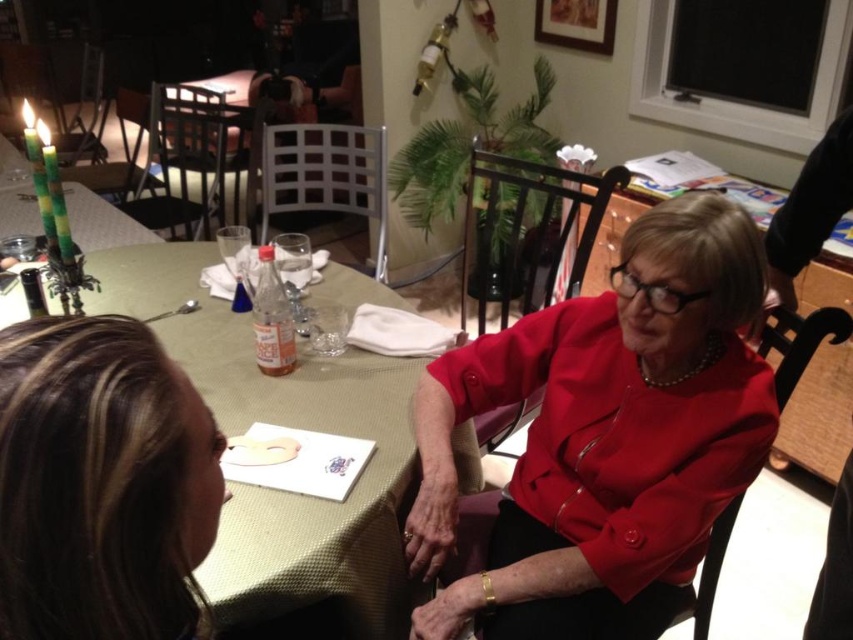
Question: Can you confirm if matte red jacket at center is smaller than brown hair at upper left?

Choices:
 (A) yes
 (B) no

Answer: (B)

Question: Which object is the farthest from the brown hair at upper left?

Choices:
 (A) matte red jacket at center
 (B) green fabric table at center

Answer: (A)

Question: Is matte red jacket at center positioned in front of brown hair at upper left?

Choices:
 (A) no
 (B) yes

Answer: (A)

Question: Is matte red jacket at center closer to the viewer compared to brown hair at upper left?

Choices:
 (A) no
 (B) yes

Answer: (A)

Question: Among these objects, which one is farthest from the camera?

Choices:
 (A) matte red jacket at center
 (B) brown hair at upper left
 (C) green fabric table at center

Answer: (C)

Question: Which object appears farthest from the camera in this image?

Choices:
 (A) matte red jacket at center
 (B) green fabric table at center
 (C) brown hair at upper left

Answer: (B)